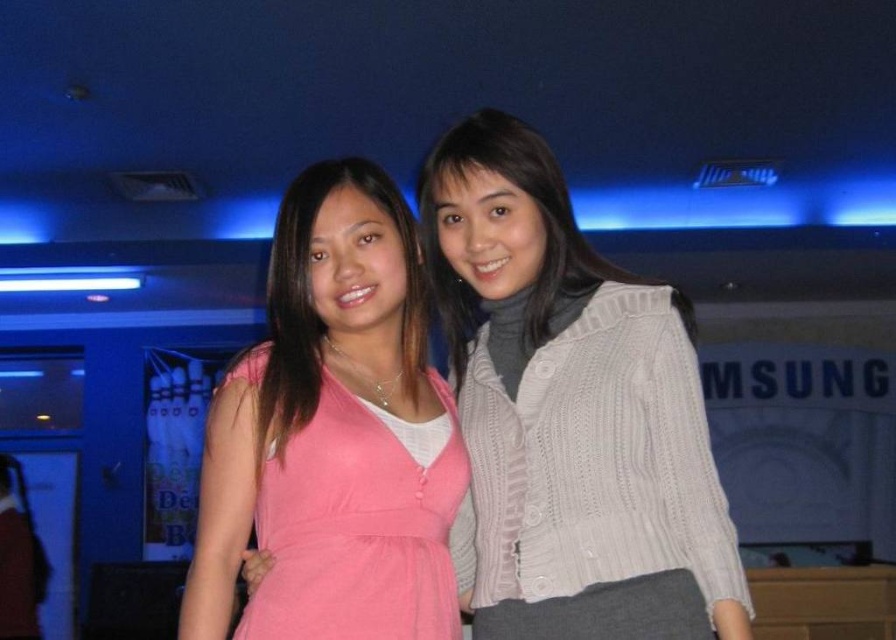
You are at a Samsung event and want to take a photo of both the white knitted sweater at center and the pink fabric dress at center. Since the camera can only focus on one object at a time, which one should you focus on first to ensure the closer object is sharp?

The white knitted sweater at center is closer to the viewer than the pink fabric dress at center, so you should focus on the white knitted sweater at center first to ensure it is sharp.

You are at a Samsung event with a 20 cm wide trophy to present. The white knitted sweater at center and pink fabric dress at center are two attendees standing near each other. Can the trophy fit between them without touching either?

The white knitted sweater at center and pink fabric dress at center are 19.79 centimeters apart, so the 20 cm wide trophy cannot fit between them without touching either.

You are at a Samsung event and need to take a photo of both the pink fabric dress at center and the white knitted sweater at upper right. Since the camera can only focus on one object at a time, which one should you focus on first to ensure the other is still in the frame?

The pink fabric dress at center is positioned on the left side of white knitted sweater at upper right, so focusing on the white knitted sweater at upper right first would keep the pink fabric dress at center within the frame as it is to the left of it.